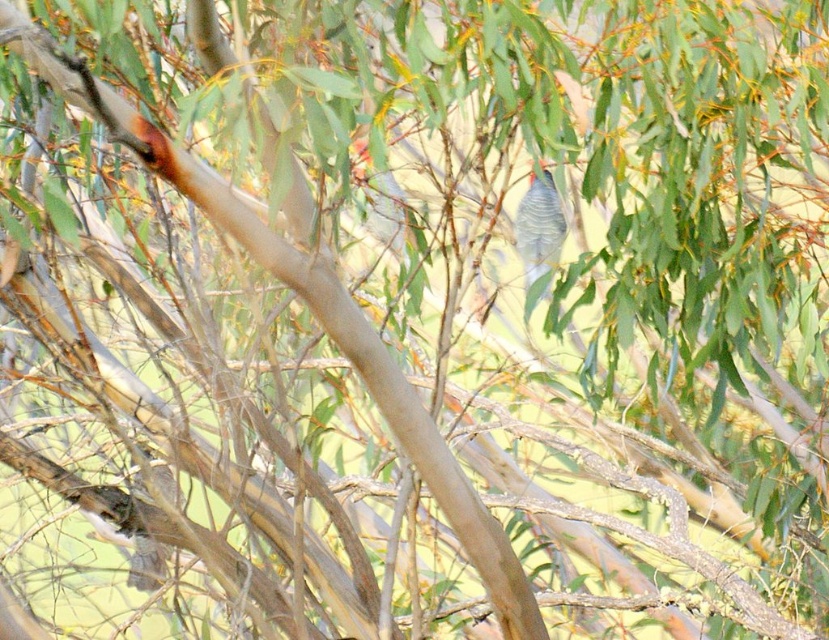
You are a photographer trying to capture the speckled gray bird at center. You notice the brown speckled feathers at lower left in the foreground. Will the feathers block your view of the bird?

The brown speckled feathers at lower left are closer to the viewer than the speckled gray bird at center, so they will block the view of the speckled gray bird at center.